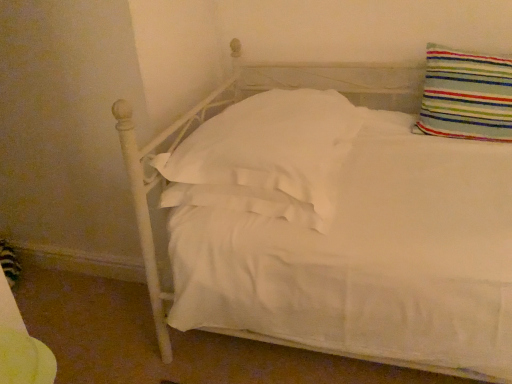
This screenshot has width=512, height=384. What do you see at coordinates (466, 96) in the screenshot? I see `striped fabric pillow at upper right, the 1th pillow viewed from the right` at bounding box center [466, 96].

Locate an element on the screen. striped fabric pillow at upper right, the second pillow positioned from the left is located at coordinates (466, 96).

What do you see at coordinates (266, 157) in the screenshot?
I see `white soft pillow at center, which ranks as the second pillow in right-to-left order` at bounding box center [266, 157].

What are the coordinates of `white soft pillow at center, which ranks as the second pillow in right-to-left order` in the screenshot? It's located at (266, 157).

Find the location of `striped fabric pillow at upper right, the second pillow positioned from the left`. striped fabric pillow at upper right, the second pillow positioned from the left is located at coordinates (466, 96).

Which object is positioned more to the right, white soft pillow at center, the first pillow positioned from the left, or striped fabric pillow at upper right, the 1th pillow viewed from the right?

striped fabric pillow at upper right, the 1th pillow viewed from the right.

In the image, is white soft pillow at center, the first pillow positioned from the left, positioned in front of or behind striped fabric pillow at upper right, the second pillow positioned from the left?

In the image, white soft pillow at center, the first pillow positioned from the left, appears in front of striped fabric pillow at upper right, the second pillow positioned from the left.

Which is less distant, (x=247, y=166) or (x=435, y=108)?

Positioned in front is point (x=247, y=166).

From the image's perspective, which is below, white soft pillow at center, the first pillow positioned from the left, or striped fabric pillow at upper right, the 1th pillow viewed from the right?

white soft pillow at center, the first pillow positioned from the left, from the image's perspective.

From a real-world perspective, is white soft pillow at center, which ranks as the second pillow in right-to-left order, positioned over striped fabric pillow at upper right, the 1th pillow viewed from the right, based on gravity?

Incorrect, from a real-world perspective, white soft pillow at center, which ranks as the second pillow in right-to-left order, is lower than striped fabric pillow at upper right, the 1th pillow viewed from the right.

Which of these two, white soft pillow at center, which ranks as the second pillow in right-to-left order, or striped fabric pillow at upper right, the 1th pillow viewed from the right, is wider?

white soft pillow at center, which ranks as the second pillow in right-to-left order.

Between white soft pillow at center, the first pillow positioned from the left, and striped fabric pillow at upper right, the second pillow positioned from the left, which one has less height?

white soft pillow at center, the first pillow positioned from the left.

Based on their sizes in the image, would you say white soft pillow at center, which ranks as the second pillow in right-to-left order, is bigger or smaller than striped fabric pillow at upper right, the 1th pillow viewed from the right?

In the image, white soft pillow at center, which ranks as the second pillow in right-to-left order, appears to be larger than striped fabric pillow at upper right, the 1th pillow viewed from the right.

Is striped fabric pillow at upper right, the 1th pillow viewed from the right, a part of white soft pillow at center, which ranks as the second pillow in right-to-left order?

No.

Are white soft pillow at center, which ranks as the second pillow in right-to-left order, and striped fabric pillow at upper right, the second pillow positioned from the left, located far from each other?

No.

Is white soft pillow at center, the first pillow positioned from the left, facing towards striped fabric pillow at upper right, the second pillow positioned from the left?

No, white soft pillow at center, the first pillow positioned from the left, is not aimed at striped fabric pillow at upper right, the second pillow positioned from the left.

Measure the distance from white soft pillow at center, the first pillow positioned from the left, to striped fabric pillow at upper right, the second pillow positioned from the left.

The distance of white soft pillow at center, the first pillow positioned from the left, from striped fabric pillow at upper right, the second pillow positioned from the left, is 21.04 inches.

The height and width of the screenshot is (384, 512). What are the coordinates of `pillow that is above the white soft pillow at center, which ranks as the second pillow in right-to-left order (from a real-world perspective)` in the screenshot? It's located at (466, 96).

Based on the photo, which is more to the right, striped fabric pillow at upper right, the second pillow positioned from the left, or white soft pillow at center, which ranks as the second pillow in right-to-left order?

striped fabric pillow at upper right, the second pillow positioned from the left.

Is striped fabric pillow at upper right, the 1th pillow viewed from the right, behind white soft pillow at center, which ranks as the second pillow in right-to-left order?

Yes, the depth of striped fabric pillow at upper right, the 1th pillow viewed from the right, is greater than that of white soft pillow at center, which ranks as the second pillow in right-to-left order.

Is point (426, 49) closer to viewer compared to point (311, 211)?

No, (426, 49) is behind (311, 211).

From the image's perspective, is striped fabric pillow at upper right, the 1th pillow viewed from the right, located above or below white soft pillow at center, which ranks as the second pillow in right-to-left order?

striped fabric pillow at upper right, the 1th pillow viewed from the right, is above white soft pillow at center, which ranks as the second pillow in right-to-left order.

From a real-world perspective, between striped fabric pillow at upper right, the second pillow positioned from the left, and white soft pillow at center, which ranks as the second pillow in right-to-left order, who is vertically higher?

striped fabric pillow at upper right, the second pillow positioned from the left.

Between striped fabric pillow at upper right, the second pillow positioned from the left, and white soft pillow at center, the first pillow positioned from the left, which one has smaller width?

With smaller width is striped fabric pillow at upper right, the second pillow positioned from the left.

Between striped fabric pillow at upper right, the second pillow positioned from the left, and white soft pillow at center, the first pillow positioned from the left, which one has more height?

striped fabric pillow at upper right, the second pillow positioned from the left.

Considering the relative sizes of striped fabric pillow at upper right, the 1th pillow viewed from the right, and white soft pillow at center, which ranks as the second pillow in right-to-left order, in the image provided, is striped fabric pillow at upper right, the 1th pillow viewed from the right, smaller than white soft pillow at center, which ranks as the second pillow in right-to-left order,?

Indeed, striped fabric pillow at upper right, the 1th pillow viewed from the right, has a smaller size compared to white soft pillow at center, which ranks as the second pillow in right-to-left order.

Which is correct: striped fabric pillow at upper right, the second pillow positioned from the left, is inside white soft pillow at center, the first pillow positioned from the left, or outside of it?

striped fabric pillow at upper right, the second pillow positioned from the left, is spatially situated outside white soft pillow at center, the first pillow positioned from the left.

Are striped fabric pillow at upper right, the 1th pillow viewed from the right, and white soft pillow at center, the first pillow positioned from the left, located far from each other?

striped fabric pillow at upper right, the 1th pillow viewed from the right, is near white soft pillow at center, the first pillow positioned from the left, not far away.

Is striped fabric pillow at upper right, the 1th pillow viewed from the right, facing away from white soft pillow at center, the first pillow positioned from the left?

striped fabric pillow at upper right, the 1th pillow viewed from the right, is not turned away from white soft pillow at center, the first pillow positioned from the left.

How many degrees apart are the facing directions of striped fabric pillow at upper right, the second pillow positioned from the left, and white soft pillow at center, the first pillow positioned from the left?

The angle between the facing direction of striped fabric pillow at upper right, the second pillow positioned from the left, and the facing direction of white soft pillow at center, the first pillow positioned from the left, is 2.56 degrees.

At what (x,y) coordinates should I click in order to perform the action: click on pillow that appears behind the white soft pillow at center, the first pillow positioned from the left. Please return your answer as a coordinate pair (x, y). Looking at the image, I should click on (466, 96).

This screenshot has width=512, height=384. Find the location of `pillow that is below the striped fabric pillow at upper right, the second pillow positioned from the left (from the image's perspective)`. pillow that is below the striped fabric pillow at upper right, the second pillow positioned from the left (from the image's perspective) is located at coordinates (266, 157).

Where is `pillow that appears behind the white soft pillow at center, the first pillow positioned from the left`? Image resolution: width=512 pixels, height=384 pixels. pillow that appears behind the white soft pillow at center, the first pillow positioned from the left is located at coordinates (466, 96).